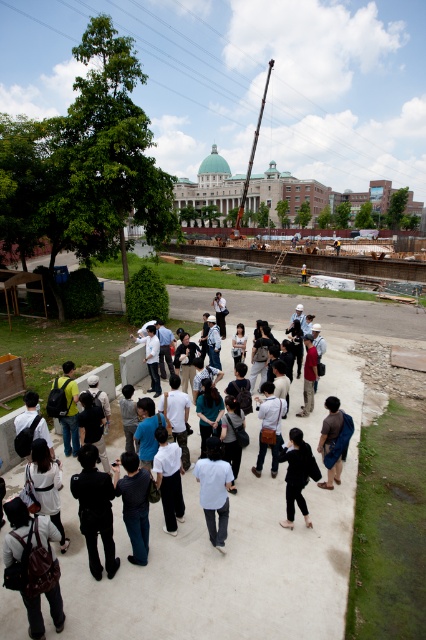
Question: Does matte brown backpack at lower left appear under black matte jacket at lower center?

Choices:
 (A) yes
 (B) no

Answer: (A)

Question: Which object is closer to the camera taking this photo?

Choices:
 (A) white matte shirt at center
 (B) matte brown backpack at lower left

Answer: (B)

Question: Which of the following is the closest to the observer?

Choices:
 (A) brown fabric shirt at center
 (B) black matte jacket at lower center
 (C) matte brown backpack at lower left

Answer: (C)

Question: Is white concrete pavement at center further to the viewer compared to black matte jacket at lower center?

Choices:
 (A) no
 (B) yes

Answer: (A)

Question: Can you confirm if matte brown backpack at lower left is wider than brown fabric shirt at center?

Choices:
 (A) no
 (B) yes

Answer: (B)

Question: Among these objects, which one is farthest from the camera?

Choices:
 (A) black matte jacket at lower center
 (B) brown fabric shirt at center
 (C) matte brown backpack at lower left

Answer: (B)